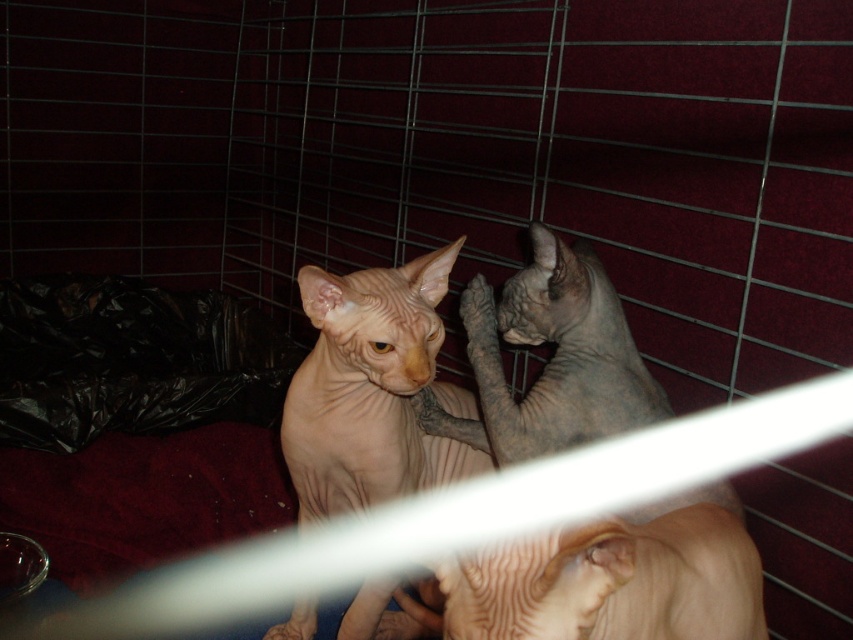
Question: Is gray textured cat at center above smooth beige cat at center?

Choices:
 (A) yes
 (B) no

Answer: (A)

Question: Considering the relative positions of gray textured cat at center and smooth beige cat at center in the image provided, where is gray textured cat at center located with respect to smooth beige cat at center?

Choices:
 (A) above
 (B) below

Answer: (A)

Question: Where is gray textured cat at center located in relation to smooth beige cat at center in the image?

Choices:
 (A) below
 (B) above

Answer: (B)

Question: Which point is closer to the camera?

Choices:
 (A) gray textured cat at center
 (B) smooth beige cat at center

Answer: (A)